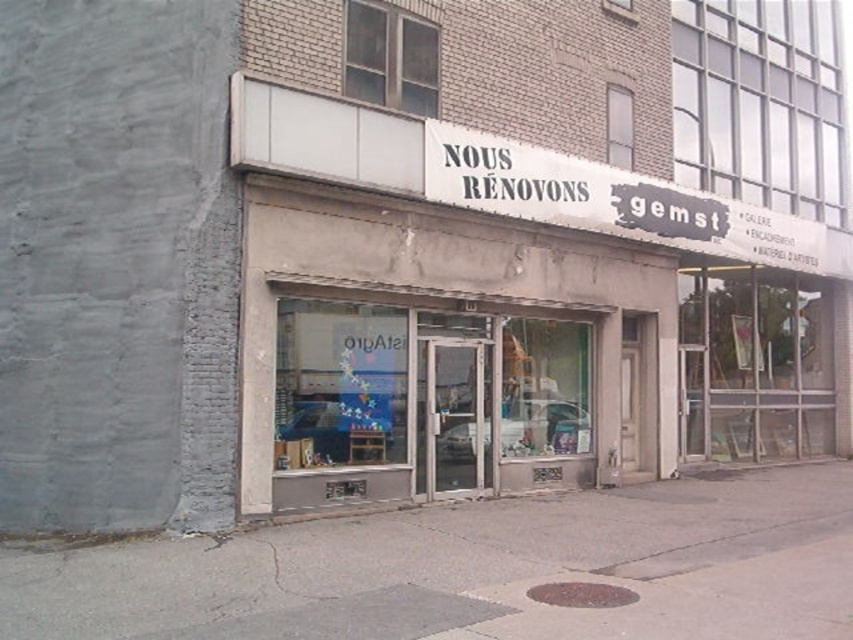
You are a customer looking through the transparent glass shop window at center and notice the white paper sign at upper center. Which object is taller?

The transparent glass shop window at center is much taller than the white paper sign at upper center.

Looking at this image, you are a customer looking at the storefront. The transparent glass shop window at center and the white paper sign at upper center are both visible. Which object is wider?

The white paper sign at upper center is wider than the transparent glass shop window at center.

You are standing in front of the building and want to look through the transparent glass shop window at center. Based on its 2D coordinates, is the window closer to the left or right side of the storefront?

The transparent glass shop window at center is located at point 0.628 on the x axis, which is closer to the right side of the storefront since 0.628 is greater than 0.5.